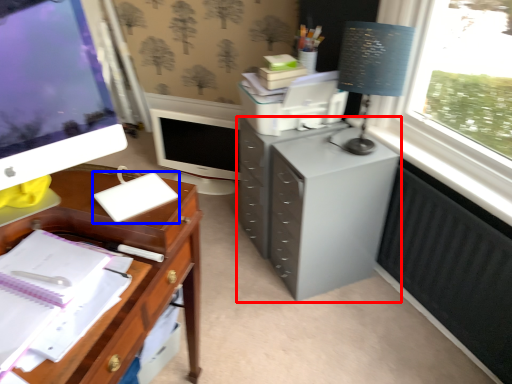
Question: Among these objects, which one is nearest to the camera, filing cabinet (highlighted by a red box) or notebook (highlighted by a blue box)?

Choices:
 (A) filing cabinet
 (B) notebook

Answer: (B)